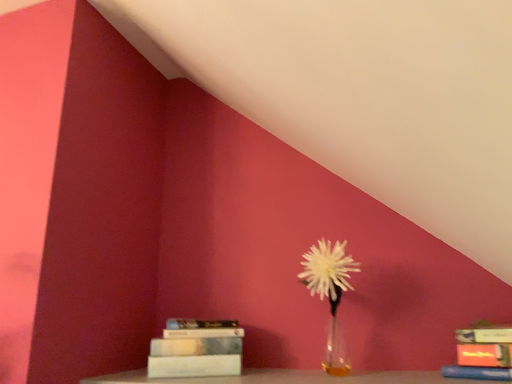
Question: In the image, is hardcover book at lower left, the first book from the left, on the left side or the right side of hardcover book at lower right, which is the second book from left to right?

Choices:
 (A) right
 (B) left

Answer: (B)

Question: Is hardcover book at lower left, the 2th book from the right, in front of or behind hardcover book at lower right, which is the second book from left to right, in the image?

Choices:
 (A) front
 (B) behind

Answer: (B)

Question: Which object is the closest to the translucent glass vase at center?

Choices:
 (A) hardcover book at lower right, marked as the 1th book in a front-to-back arrangement
 (B) white glass vase at center
 (C) hardcover book at lower left, the first book from the left

Answer: (C)

Question: Estimate the real-world distances between objects in this image. Which object is farther from the white glass vase at center?

Choices:
 (A) translucent glass vase at center
 (B) hardcover book at lower right, which appears as the 1th book when viewed from the right
 (C) hardcover book at lower left, positioned as the second book in front-to-back order

Answer: (B)